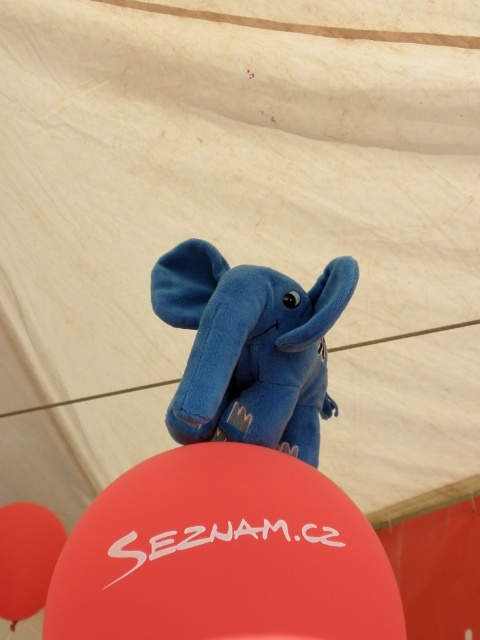
Question: Can you confirm if rubber balloon at center is thinner than blue plush elephant at center?

Choices:
 (A) no
 (B) yes

Answer: (A)

Question: Which object is farther from the camera taking this photo?

Choices:
 (A) blue plush elephant at center
 (B) smooth red balloon at lower left

Answer: (B)

Question: Does blue plush elephant at center lie in front of smooth red balloon at lower left?

Choices:
 (A) yes
 (B) no

Answer: (A)

Question: Which of the following is the farthest from the observer?

Choices:
 (A) (197, 422)
 (B) (32, 547)

Answer: (B)

Question: Among these points, which one is farthest from the camera?

Choices:
 (A) (180, 429)
 (B) (292, 552)
 (C) (4, 550)

Answer: (C)

Question: Observing the image, what is the correct spatial positioning of rubber balloon at center in reference to smooth red balloon at lower left?

Choices:
 (A) above
 (B) below

Answer: (A)